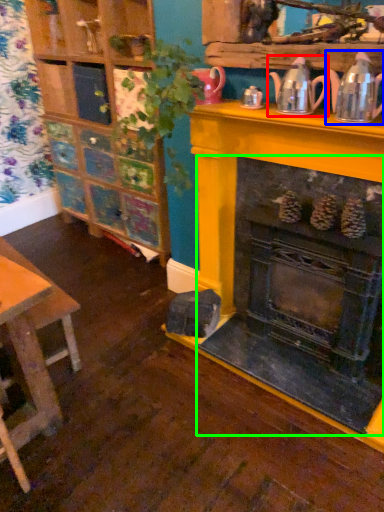
Question: Which object is the farthest from tea pot (highlighted by a red box)? Choose among these: tea pot (highlighted by a blue box) or fireplace (highlighted by a green box).

Choices:
 (A) tea pot
 (B) fireplace

Answer: (B)